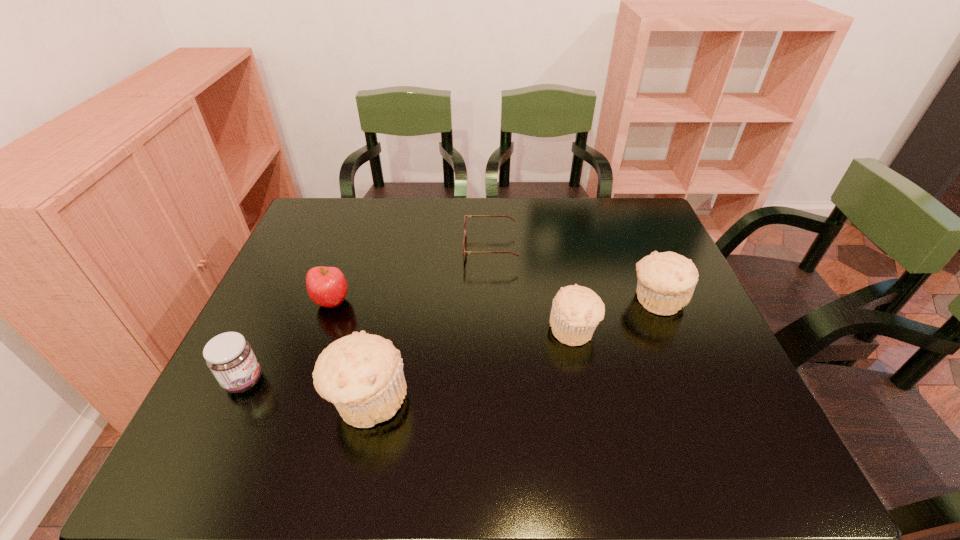
Locate which object ranks second in proximity to the leftmost muffin. Please provide its 2D coordinates. Your answer should be formatted as a tuple, i.e. [(x, y)], where the tuple contains the x and y coordinates of a point satisfying the conditions above.

[(326, 286)]

You are a GUI agent. You are given a task and a screenshot of the screen. Output one action in this format:
    pyautogui.click(x=<x>, y=<y>)
    Task: Click on the object that is the third closest to the rightmost object
    
    Given the screenshot: What is the action you would take?
    pyautogui.click(x=362, y=374)

Identify the location of muffin that is the second closest to the apple. The width and height of the screenshot is (960, 540). (576, 311).

This screenshot has width=960, height=540. I want to click on muffin that is the nearest to the nearest muffin, so click(x=576, y=311).

This screenshot has height=540, width=960. Find the location of `free space that satisfies the following two spatial constraints: 1. at the front view of the farthest object; 2. on the left side of the second muffin from left to right`. free space that satisfies the following two spatial constraints: 1. at the front view of the farthest object; 2. on the left side of the second muffin from left to right is located at coordinates (492, 329).

Where is `vacant area in the image that satisfies the following two spatial constraints: 1. on the front side of the apple; 2. on the left side of the leftmost muffin`? vacant area in the image that satisfies the following two spatial constraints: 1. on the front side of the apple; 2. on the left side of the leftmost muffin is located at coordinates (298, 400).